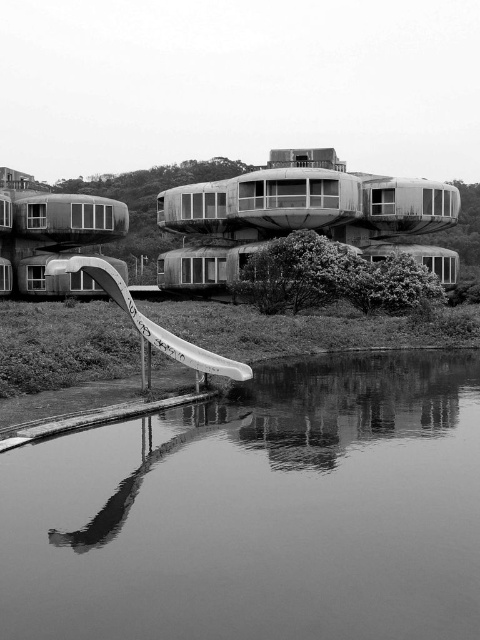
Does smooth water at bottom center have a lesser height compared to white plastic slide at lower left?

Indeed, smooth water at bottom center has a lesser height compared to white plastic slide at lower left.

Which is above, smooth water at bottom center or white plastic slide at lower left?

Positioned higher is white plastic slide at lower left.

In the scene shown: Measure the distance between point (446, 380) and camera.

Point (446, 380) and camera are 16.56 meters apart.

Identify the location of smooth water at bottom center. (259, 513).